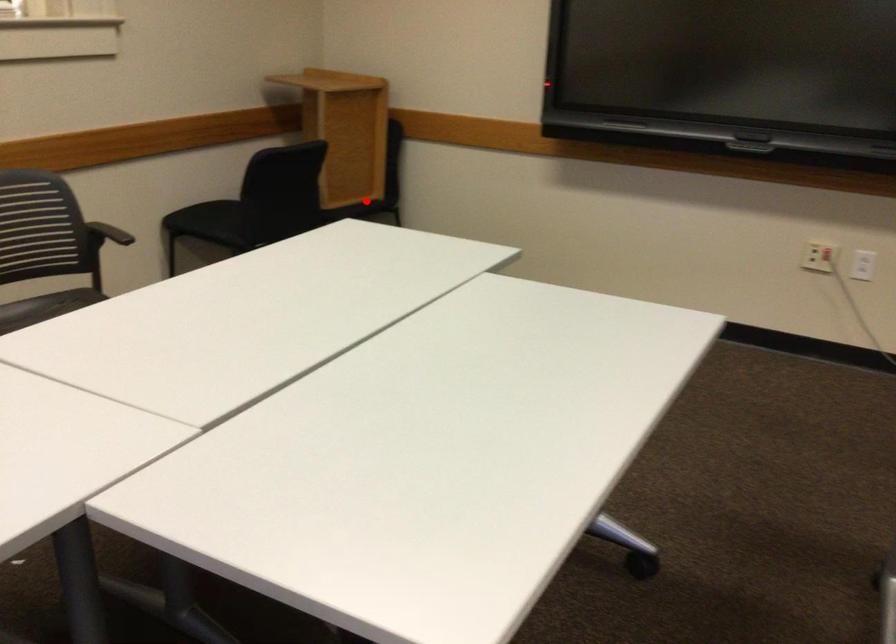
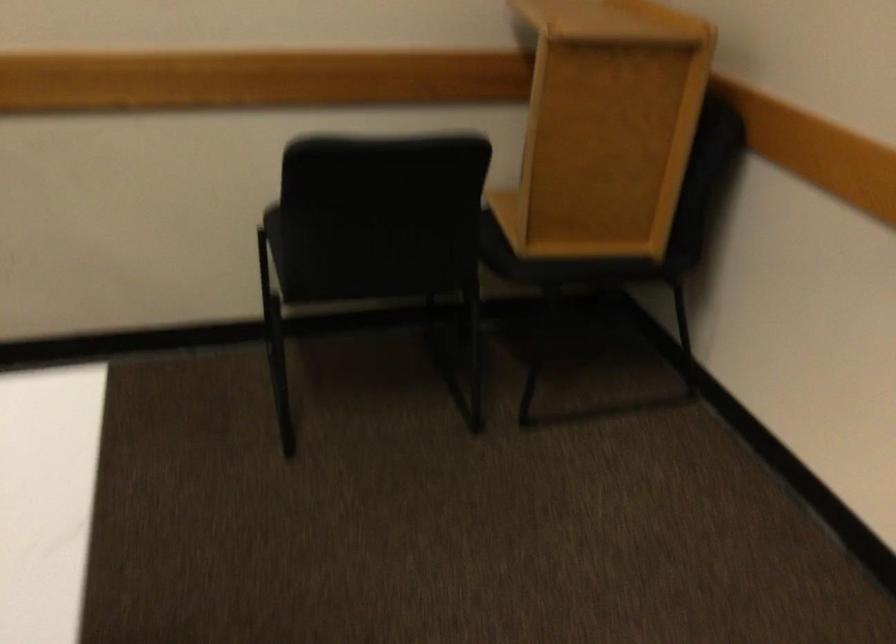
Locate, in the second image, the point that corresponds to the highlighted location in the first image.

(586, 263)